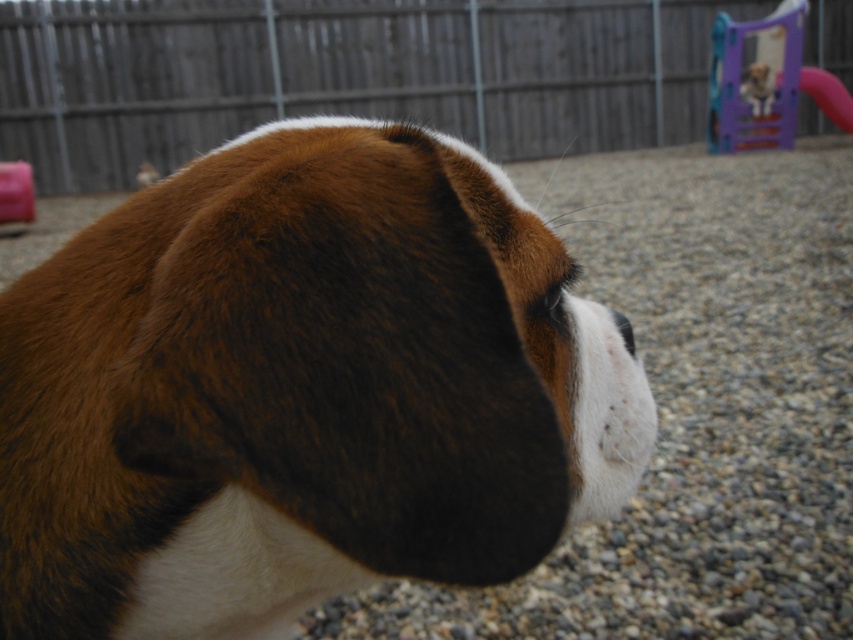
You are a photographer trying to capture the brown furry dog at center and the gray gravel at center in a single shot. Based on their positions, which object would appear closer to the camera?

The brown furry dog at center appears closer to the camera because it is positioned in front of the gray gravel at center.

You are standing at the origin point in the image. The brown furry dog at center is located at coordinates given. If you want to walk directly towards the dog, which direction should you move in terms of x and y axes?

To move directly towards the brown furry dog at center located at coordinates point (300, 390), you should move in the positive x direction and negative y direction since the dog is at a higher x and lower y coordinate than the origin.

Consider the image. You are a photographer holding a camera and want to capture a clear closeup of the dog without the gray gravel at center being in focus. What should you adjust?

To ensure the dog is in focus while keeping the gray gravel at center out of focus, you should adjust the aperture to a wider setting, which creates a shallower depth of field. This will blur the background elements like the gravel.